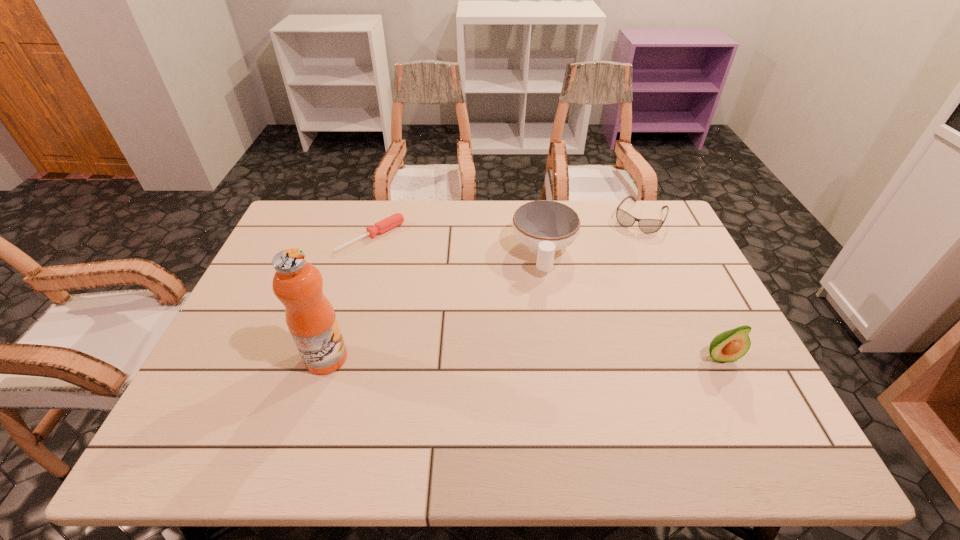
Identify the location of avocado that is positioned at the right edge. This screenshot has width=960, height=540. (731, 345).

Find the location of `sunglasses that is at the right edge`. sunglasses that is at the right edge is located at coordinates (648, 226).

Identify the location of object located in the far right corner section of the desktop. This screenshot has width=960, height=540. (648, 226).

Locate an element on the screen. The width and height of the screenshot is (960, 540). free space at the far edge of the desktop is located at coordinates (415, 234).

Locate an element on the screen. blank space at the near edge of the desktop is located at coordinates (399, 408).

Identify the location of free space at the left edge. (305, 247).

This screenshot has width=960, height=540. In the image, there is a desktop. Find the location of `free space at the far left corner`. free space at the far left corner is located at coordinates (310, 217).

Image resolution: width=960 pixels, height=540 pixels. I want to click on vacant region at the far right corner of the desktop, so click(x=636, y=230).

At what (x,y) coordinates should I click in order to perform the action: click on free area in between the avocado and the tallest object. Please return your answer as a coordinate pair (x, y). The image size is (960, 540). Looking at the image, I should click on (523, 357).

This screenshot has width=960, height=540. What are the coordinates of `vacant region between the chinaware and the fruit juice` in the screenshot? It's located at (435, 305).